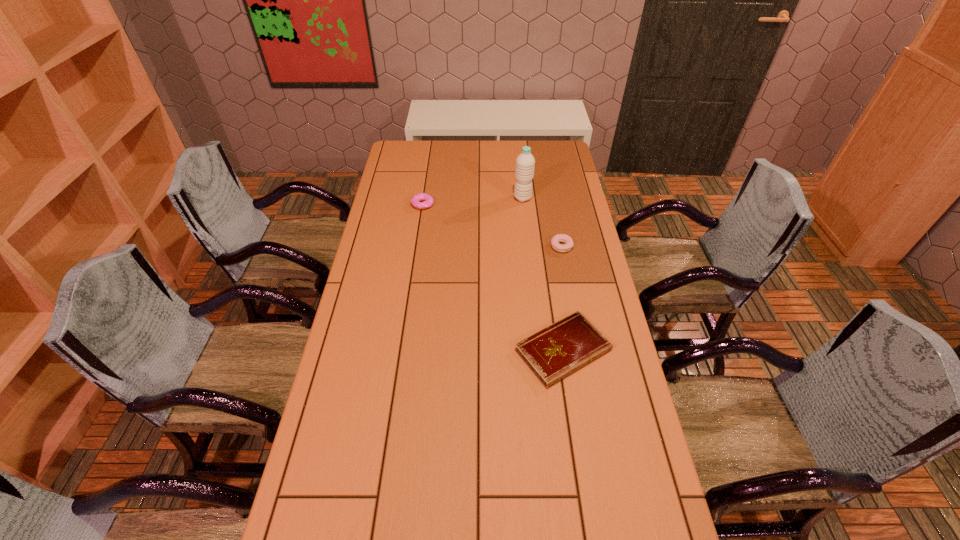
Find the location of `the tallest object`. the tallest object is located at coordinates (525, 163).

Where is `the right doughnut`? the right doughnut is located at coordinates (x=555, y=241).

Identify the location of the third farthest object. This screenshot has width=960, height=540. pyautogui.click(x=555, y=241).

At what (x,y) coordinates should I click in order to perform the action: click on the farther doughnut. Please return your answer as a coordinate pair (x, y). The width and height of the screenshot is (960, 540). Looking at the image, I should click on (428, 200).

The height and width of the screenshot is (540, 960). What are the coordinates of `the leftmost object` in the screenshot? It's located at (428, 200).

Locate an element on the screen. This screenshot has width=960, height=540. notebook is located at coordinates (553, 353).

At what (x,y) coordinates should I click in order to perform the action: click on the shortest object. Please return your answer as a coordinate pair (x, y). Looking at the image, I should click on (553, 353).

The height and width of the screenshot is (540, 960). What are the coordinates of `vacant space located 0.110m on the left of the tallest object` in the screenshot? It's located at (488, 198).

The width and height of the screenshot is (960, 540). I want to click on vacant space located 0.150m on the back of the nearer doughnut, so click(x=556, y=215).

Where is `vacant space positioned 0.100m on the back of the farther doughnut`? The image size is (960, 540). vacant space positioned 0.100m on the back of the farther doughnut is located at coordinates point(425,185).